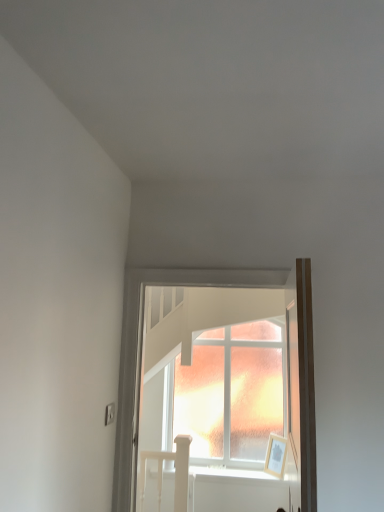
Question: Is white wooden bed at lower left far from frosted glass window at center?

Choices:
 (A) yes
 (B) no

Answer: (A)

Question: Considering the relative sizes of white wooden bed at lower left and frosted glass window at center in the image provided, is white wooden bed at lower left wider than frosted glass window at center?

Choices:
 (A) yes
 (B) no

Answer: (B)

Question: Is white wooden bed at lower left not within frosted glass window at center?

Choices:
 (A) no
 (B) yes

Answer: (B)

Question: Does white wooden bed at lower left appear on the left side of frosted glass window at center?

Choices:
 (A) yes
 (B) no

Answer: (A)

Question: Is white wooden bed at lower left positioned behind frosted glass window at center?

Choices:
 (A) yes
 (B) no

Answer: (A)

Question: Is white wooden bed at lower left in front of frosted glass window at center?

Choices:
 (A) no
 (B) yes

Answer: (A)

Question: Is the position of frosted glass window at center more distant than that of white wooden bed at lower left?

Choices:
 (A) yes
 (B) no

Answer: (B)

Question: Considering the relative sizes of frosted glass window at center and white wooden bed at lower left in the image provided, is frosted glass window at center taller than white wooden bed at lower left?

Choices:
 (A) yes
 (B) no

Answer: (A)

Question: From a real-world perspective, is frosted glass window at center positioned under white wooden bed at lower left based on gravity?

Choices:
 (A) no
 (B) yes

Answer: (A)

Question: Is frosted glass window at center not inside white wooden bed at lower left?

Choices:
 (A) yes
 (B) no

Answer: (A)

Question: From the image's perspective, would you say frosted glass window at center is shown under white wooden bed at lower left?

Choices:
 (A) no
 (B) yes

Answer: (A)

Question: Considering the relative positions of frosted glass window at center and white wooden bed at lower left in the image provided, is frosted glass window at center to the left of white wooden bed at lower left from the viewer's perspective?

Choices:
 (A) yes
 (B) no

Answer: (B)

Question: Is frosted glass window at center in front of or behind white wooden bed at lower left in the image?

Choices:
 (A) front
 (B) behind

Answer: (A)